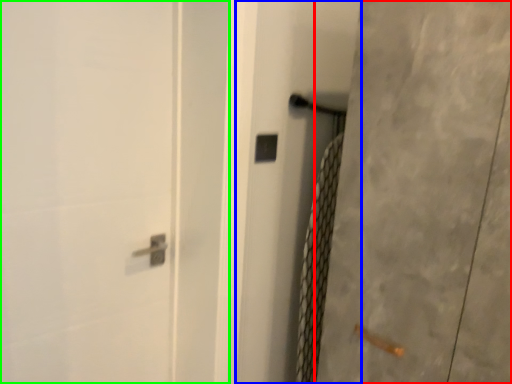
Question: Which object is the farthest from screen door (highlighted by a red box)? Choose among these: screen door (highlighted by a blue box) or screen door (highlighted by a green box).

Choices:
 (A) screen door
 (B) screen door

Answer: (B)